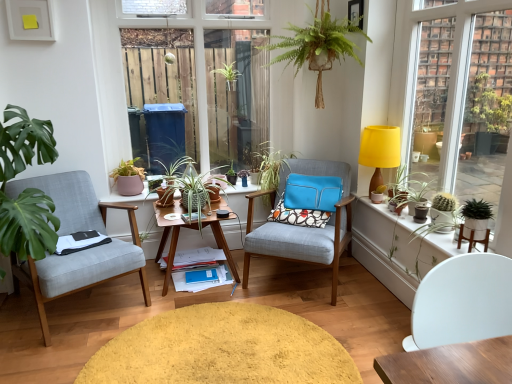
Find the location of a particular element. Image resolution: width=512 pixels, height=384 pixels. vacant space situated above yellow plush rug at center (from a real-world perspective) is located at coordinates (203, 348).